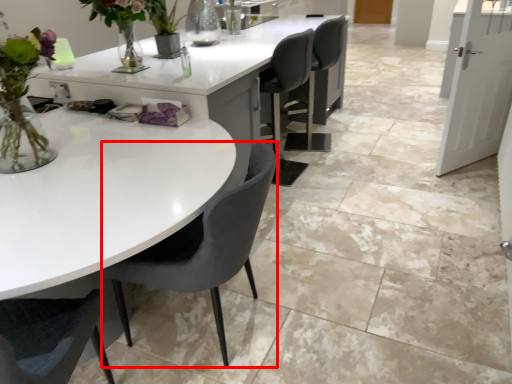
Question: From the image's perspective, where is chair (annotated by the red box) located relative to table?

Choices:
 (A) below
 (B) above

Answer: (A)